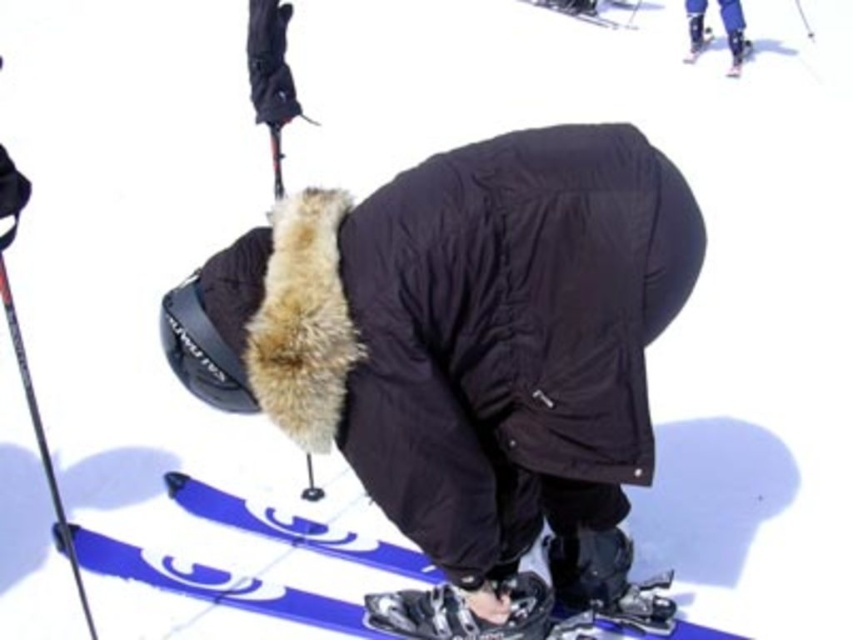
You are a ski equipment inspector checking the setup of the skis and boots. Based on the image, which object is taller between the matte black ski boot at upper right and the blue glossy ski at upper center?

The matte black ski boot at upper right is taller than the blue glossy ski at upper center according to the description.

You are a photographer trying to capture a photo of the person adjusting their skis. The camera is positioned at point A located at coordinates (465,356). What object is the camera pointing at?

The camera positioned at point A located at coordinates (465,356) is pointing at the black matte jacket at center.

You are a photographer trying to capture a closeup of both the matte black ski boot at upper right and the blue glossy ski at upper center. Which object should you focus on first to ensure it appears sharp in the photo?

The matte black ski boot at upper right is closer to the viewer than the blue glossy ski at upper center, so you should focus on the matte black ski boot at upper right first to ensure it appears sharp in the photo.